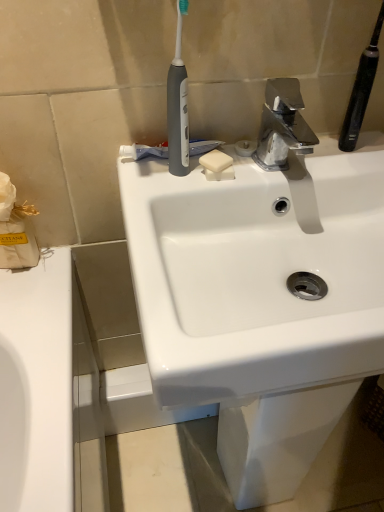
Find the location of a particular element. This screenshot has height=512, width=384. free space in front of white matte toothpaste at center is located at coordinates (163, 190).